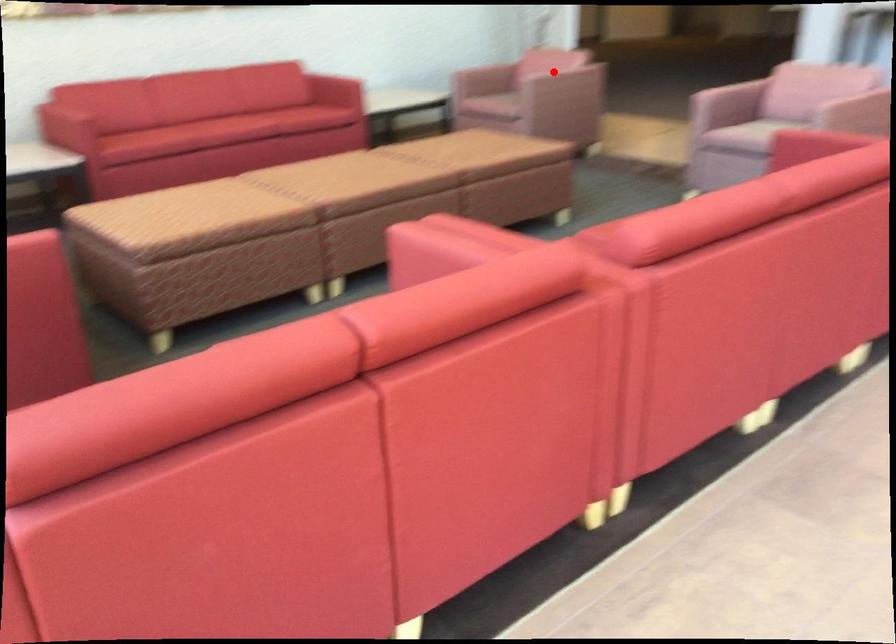
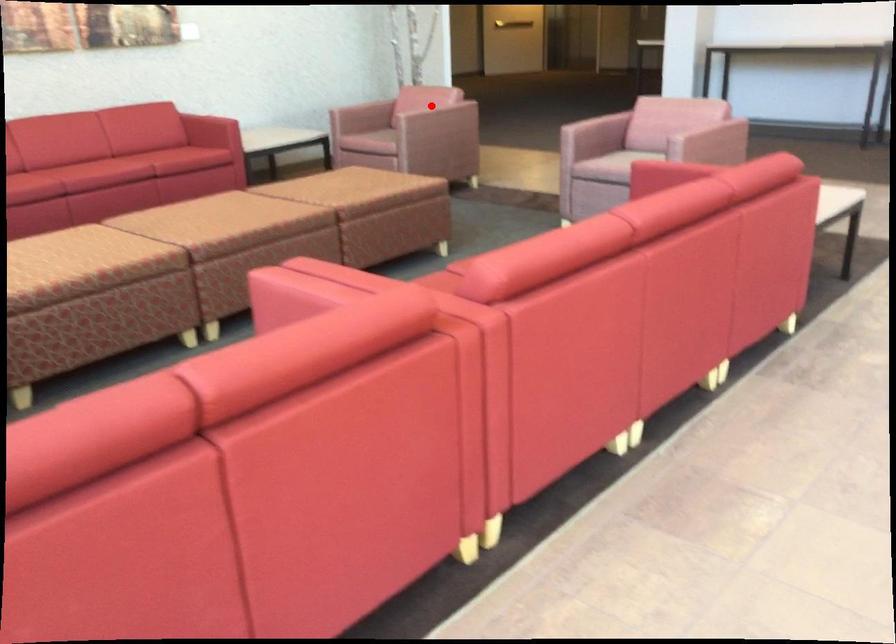
I am providing you with two images of the same scene from different viewpoints. A red point is marked on the first image and another point is marked on the second image. Do the highlighted points in image1 and image2 indicate the same real-world spot?

Yes